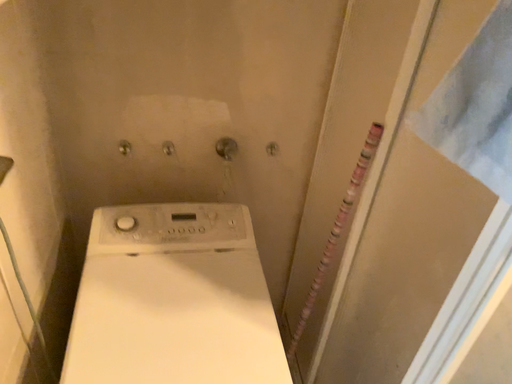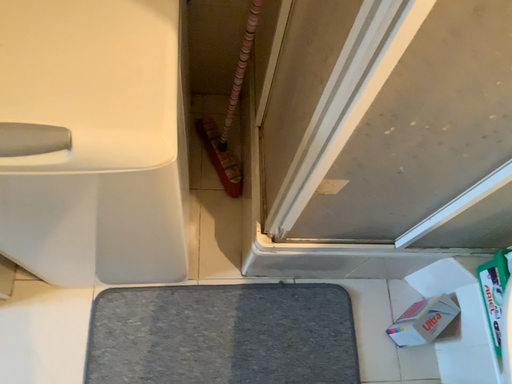
Question: How did the camera likely rotate when shooting the video?

Choices:
 (A) rotated upward
 (B) rotated downward

Answer: (B)